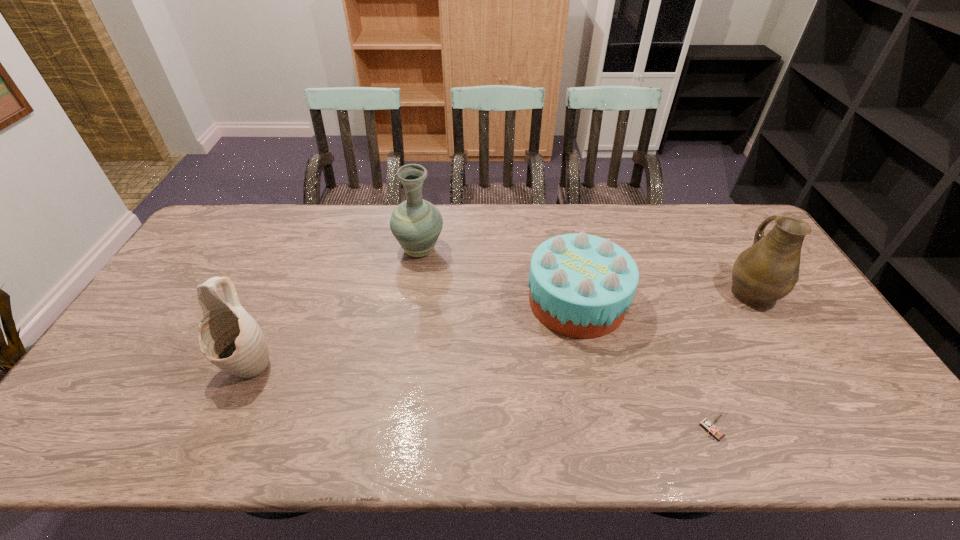
Identify the location of object located in the near edge section of the desktop. This screenshot has height=540, width=960. (711, 427).

Find the location of a particular element. The height and width of the screenshot is (540, 960). object located in the right edge section of the desktop is located at coordinates (767, 271).

Locate an element on the screen. The width and height of the screenshot is (960, 540). blank area at the far edge is located at coordinates (559, 210).

The image size is (960, 540). What are the coordinates of `blank space at the near edge` in the screenshot? It's located at (644, 437).

This screenshot has width=960, height=540. In the image, there is a desktop. Find the location of `vacant region at the left edge`. vacant region at the left edge is located at coordinates (110, 416).

In the image, there is a desktop. Identify the location of vacant space at the right edge. This screenshot has height=540, width=960. (817, 390).

In the image, there is a desktop. Where is `vacant area at the far left corner`? This screenshot has height=540, width=960. vacant area at the far left corner is located at coordinates (255, 206).

Identify the location of vacant area that lies between the leftmost object and the rightmost pitcher. The image size is (960, 540). (500, 328).

At what (x,y) coordinates should I click in order to perform the action: click on vacant area between the rightmost pitcher and the third object from left to right. Please return your answer as a coordinate pair (x, y). The height and width of the screenshot is (540, 960). Looking at the image, I should click on (663, 296).

Image resolution: width=960 pixels, height=540 pixels. I want to click on empty location between the fourth object from left to right and the rightmost pitcher, so click(731, 361).